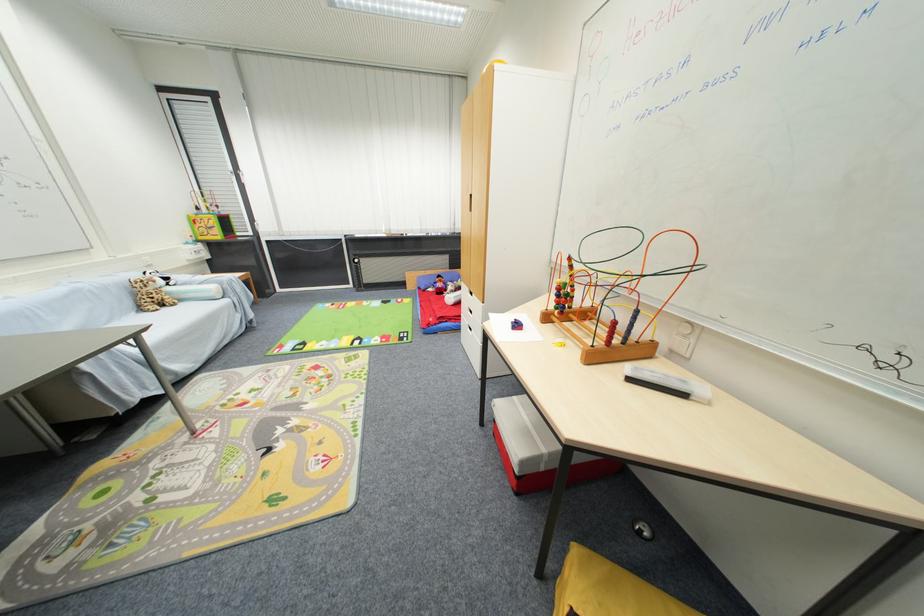
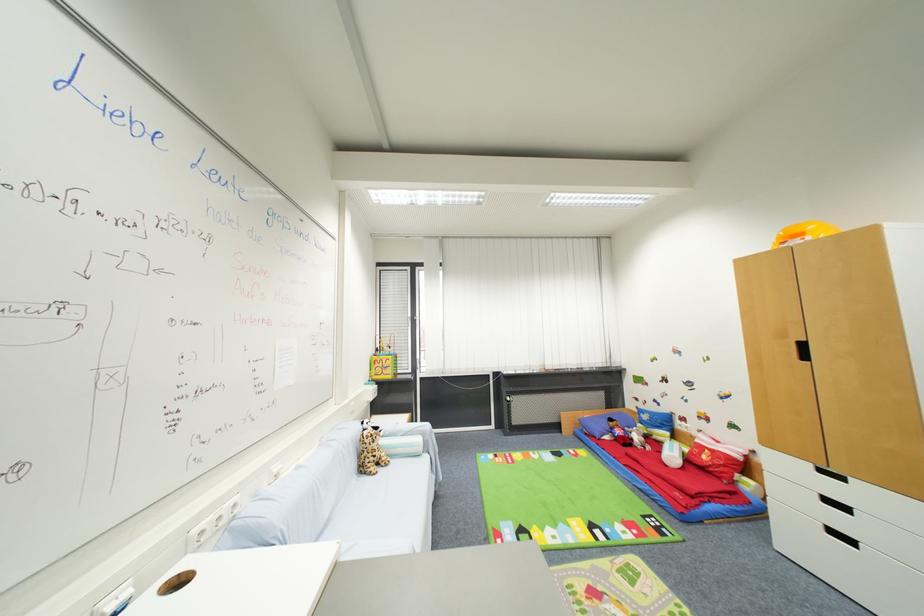
Question: Which direction would the cameraman need to move to produce the second image? Reply with the corresponding letter.

Choices:
 (A) Left
 (B) Right
 (C) Forward
 (D) Backward

Answer: (A)